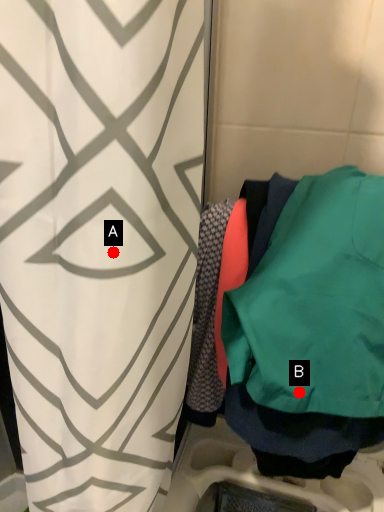
Question: Two points are circled on the image, labeled by A and B beside each circle. Which of the following is the farthest from the observer?

Choices:
 (A) A is further
 (B) B is further

Answer: (B)